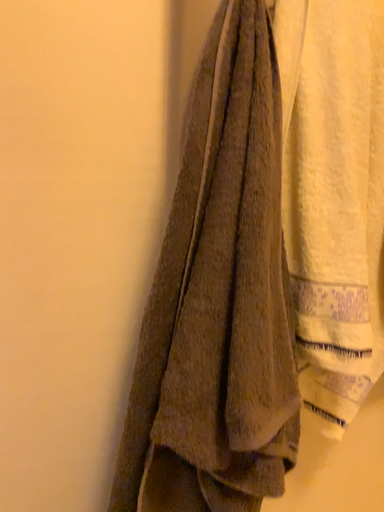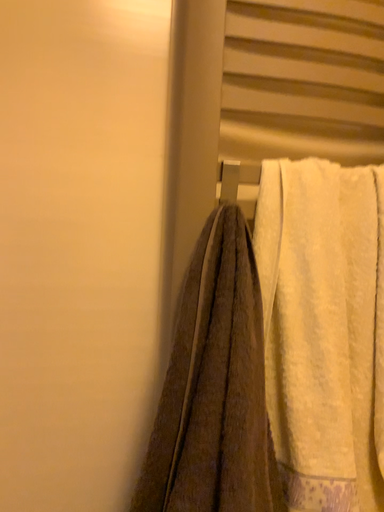
Question: Which way did the camera rotate in the video?

Choices:
 (A) rotated downward
 (B) rotated upward

Answer: (B)